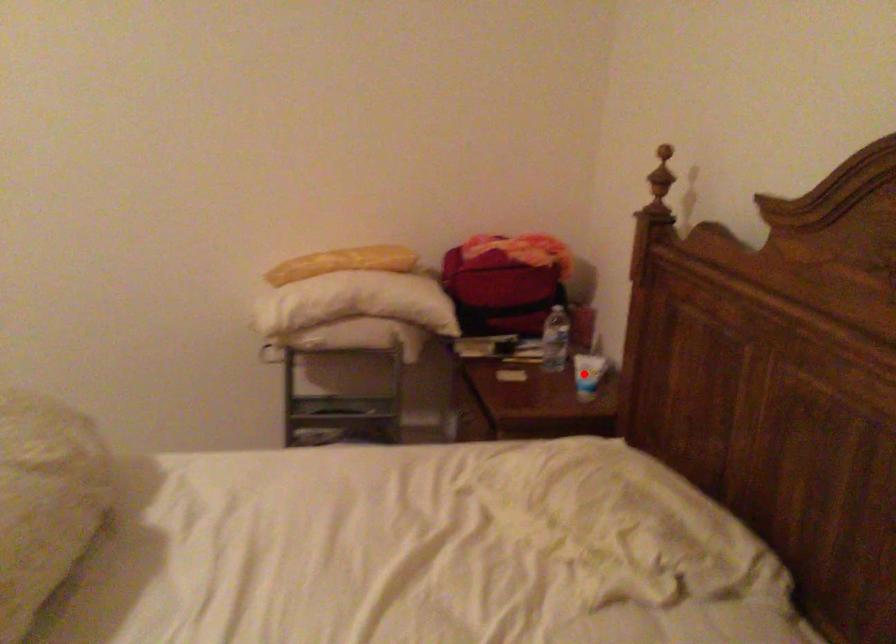
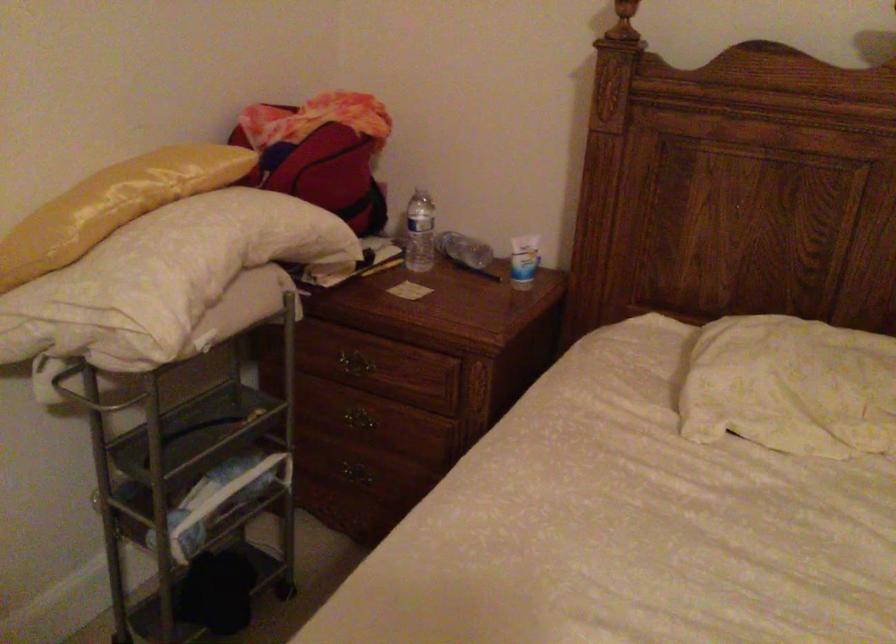
Locate, in the second image, the point that corresponds to the highlighted location in the first image.

(523, 261)